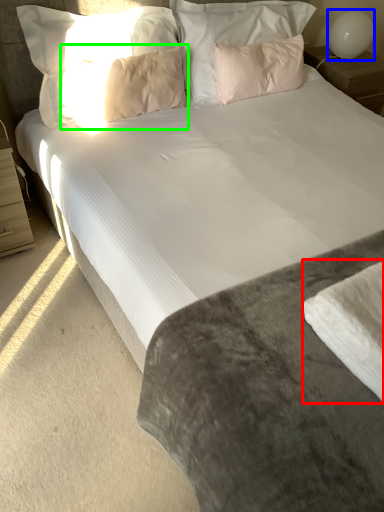
Question: Which is nearer to the sheet (highlighted by a red box)? table lamp (highlighted by a blue box) or pillow (highlighted by a green box).

Choices:
 (A) table lamp
 (B) pillow

Answer: (B)